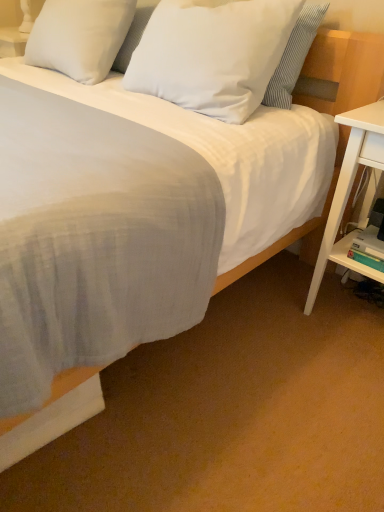
The image size is (384, 512). Find the location of `vacant space underneath white wood nightstand at right (from a real-world perspective)`. vacant space underneath white wood nightstand at right (from a real-world perspective) is located at coordinates (345, 313).